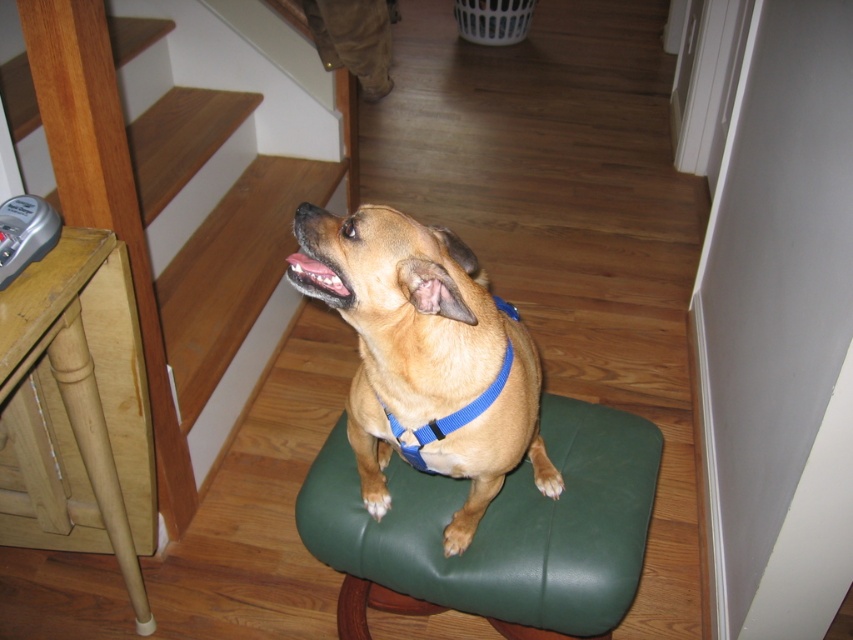
You are a robot vacuum cleaner with a diameter of 12 inches. You are in the same room as the green leather stool at center and the brown fabric dog at center. Can you navigate between them without hitting either?

The distance between the green leather stool at center and the brown fabric dog at center is 7.35 inches. Since your diameter is 12 inches, which is larger than the gap, you cannot pass between them without collision.

You are a dog owner who wants to place a new dog toy on the floor between the green leather stool at center and the blue fabric neckband at center. Given that the toy is 30 cm wide, can you fit it there without overlapping either object?

The green leather stool at center is wider than the blue fabric neckband at center, so there is enough space between them to fit a 30 cm wide toy without overlapping.